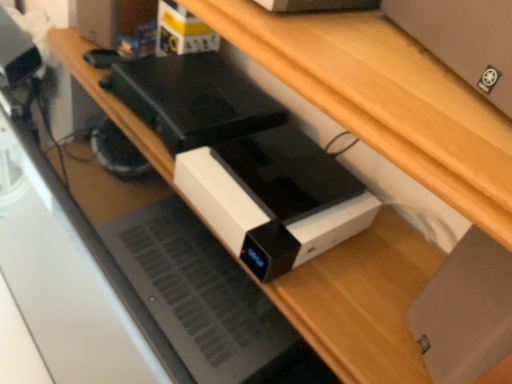
Image resolution: width=512 pixels, height=384 pixels. I want to click on matte black desktop computer at upper right, so click(x=464, y=40).

What do you see at coordinates (464, 40) in the screenshot?
I see `matte black desktop computer at upper right` at bounding box center [464, 40].

The image size is (512, 384). What are the coordinates of `matte black desktop computer at upper right` in the screenshot? It's located at (464, 40).